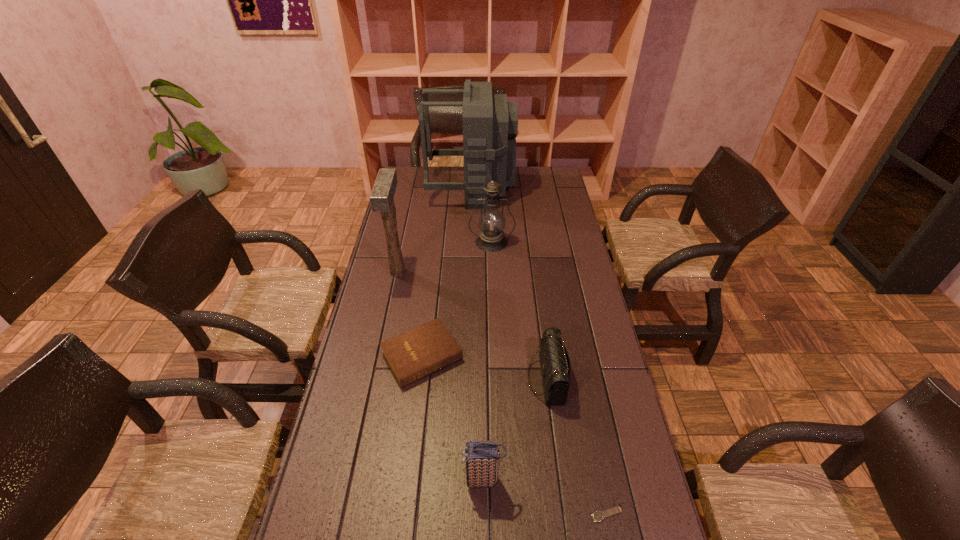
Find the location of a particular element. The image size is (960, 540). vacant point that satisfies the following two spatial constraints: 1. on the front compartment of the tallest object; 2. on the left side of the second farthest object is located at coordinates point(470,242).